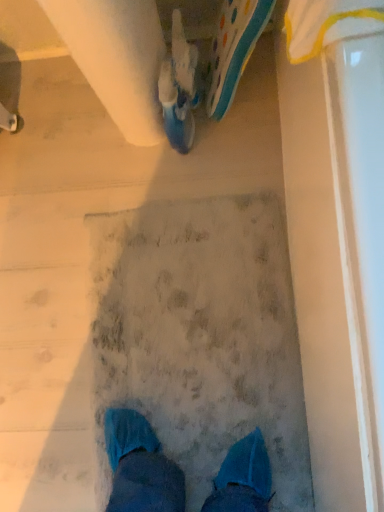
I want to click on blue fabric shoe at upper center, so click(x=233, y=49).

What do you see at coordinates (233, 49) in the screenshot? I see `blue fabric shoe at upper center` at bounding box center [233, 49].

At what (x,y) coordinates should I click in order to perform the action: click on blue fabric shoe at upper center. Please return your answer as a coordinate pair (x, y). Looking at the image, I should click on (233, 49).